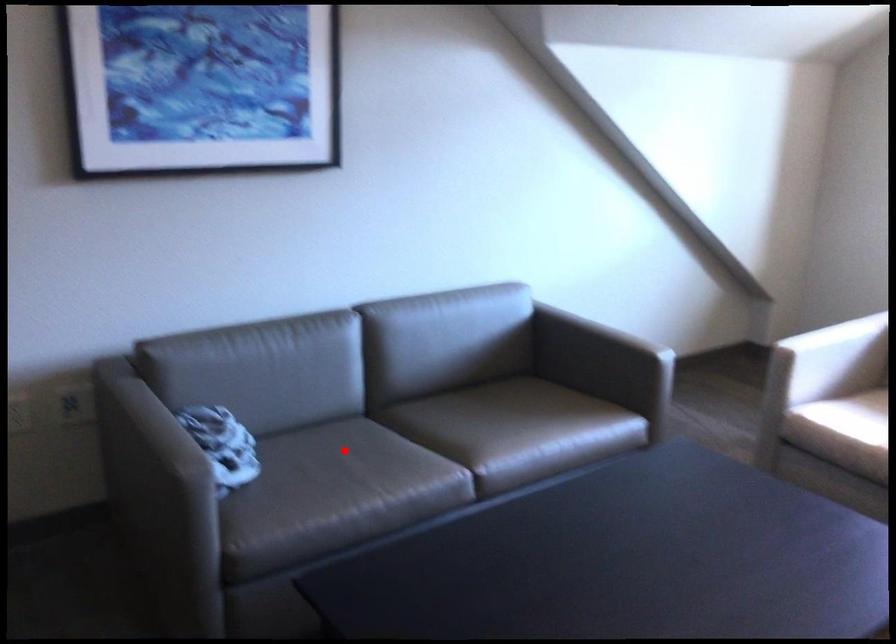
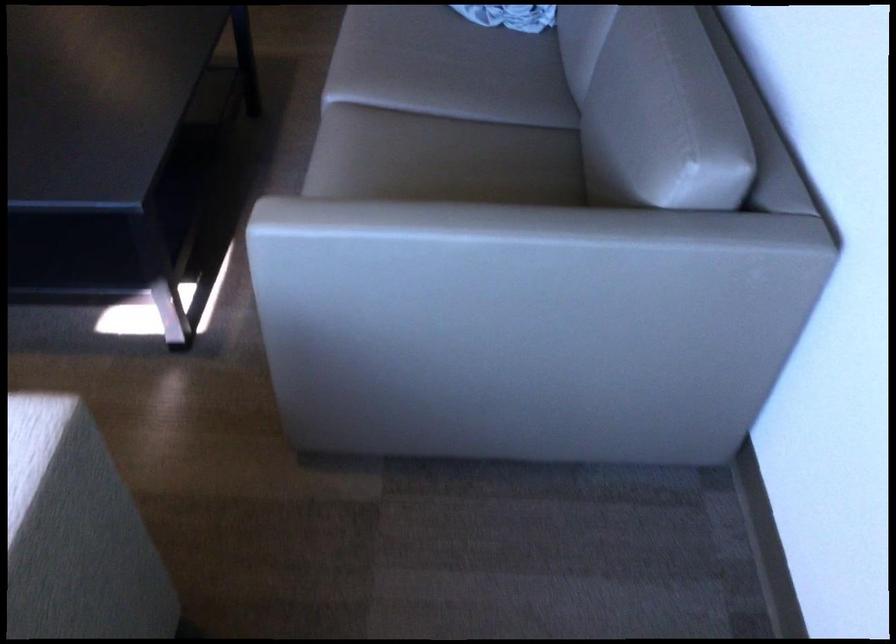
Question: I am providing you with two images of the same scene from different viewpoints. A red point is marked on the first image. Can you still see the location of the red point in image 2?

Choices:
 (A) Yes
 (B) No

Answer: (A)